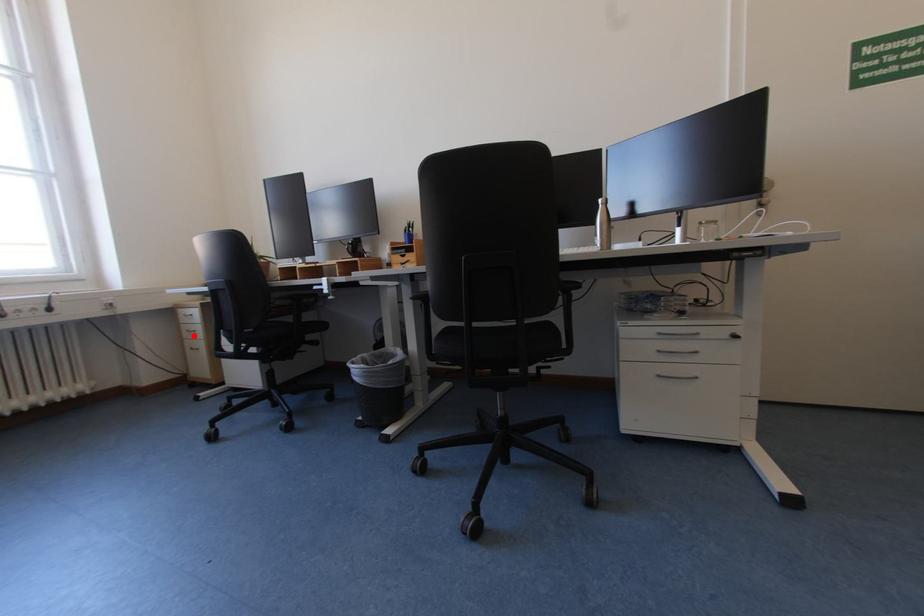
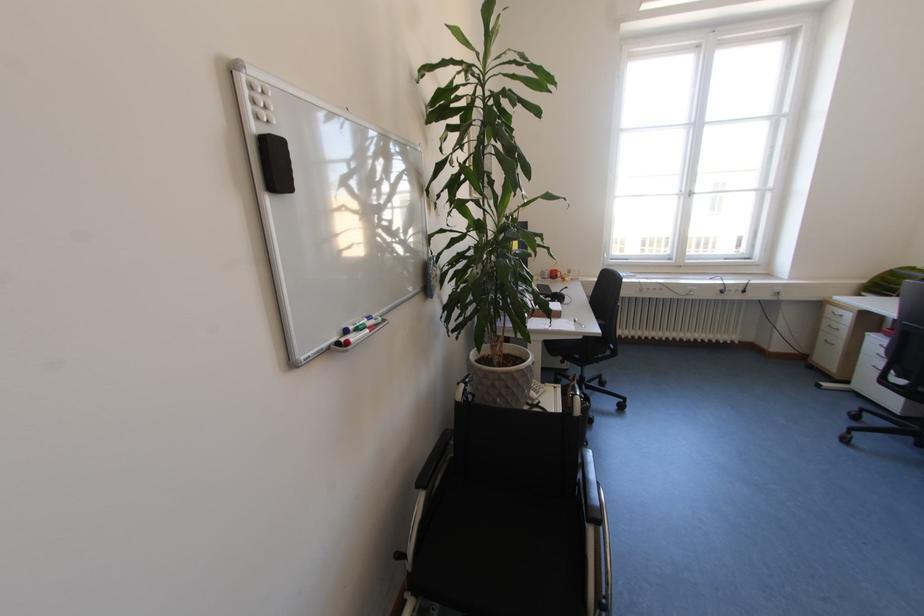
Find the pixel in the second image that matches the highlighted location in the first image.

(833, 328)